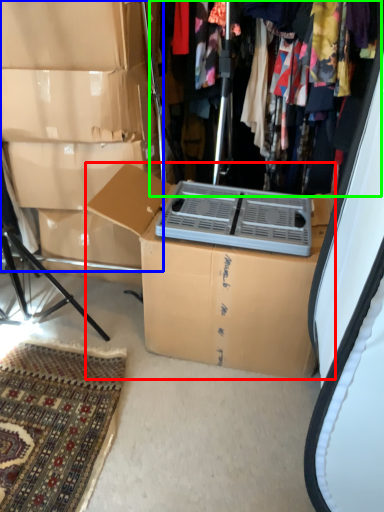
Question: Estimate the real-world distances between objects in this image. Which object is closer to box (highlighted by a red box), storage box (highlighted by a blue box) or closet (highlighted by a green box)?

Choices:
 (A) storage box
 (B) closet

Answer: (A)